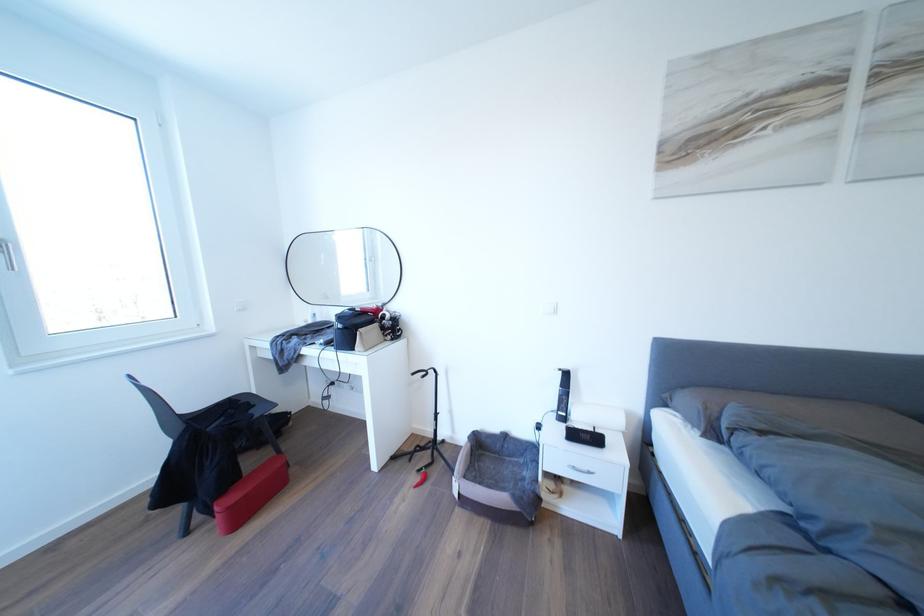
Where would you lift the red chili toy? Please return your answer as a coordinate pair (x, y).

(420, 479)